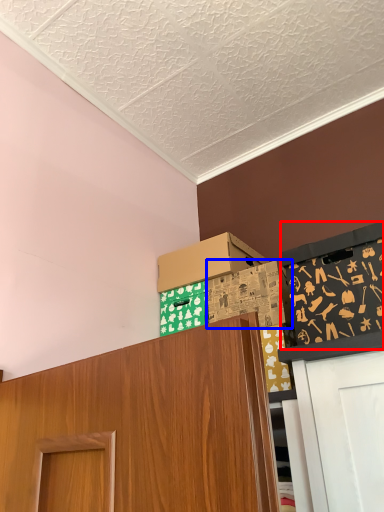
Question: Which of the following is the closest to the observer, bulletin board (highlighted by a red box) or box (highlighted by a blue box)?

Choices:
 (A) bulletin board
 (B) box

Answer: (A)